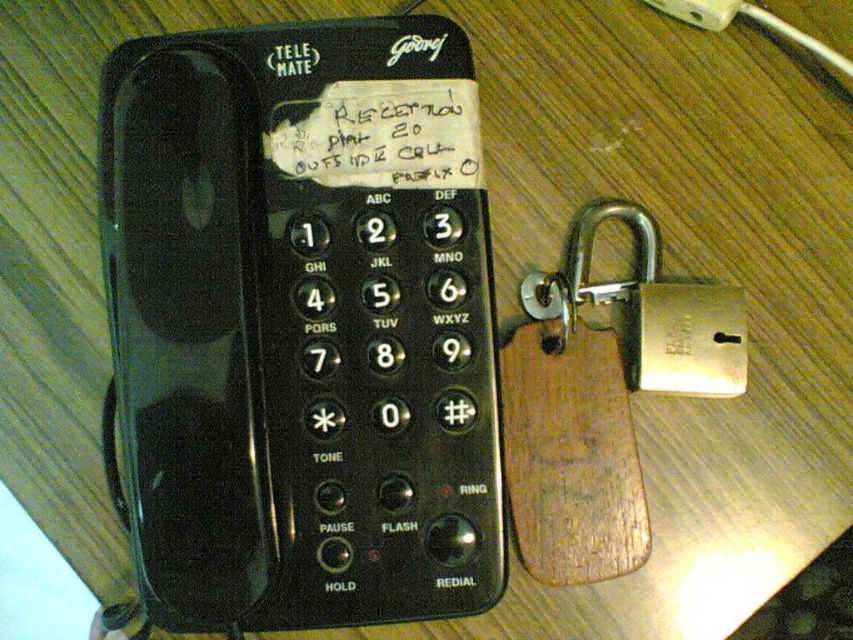
Question: Estimate the real-world distances between objects in this image. Which object is farther from the white plastic plug at upper right?

Choices:
 (A) black plastic telephone at center
 (B) white paper at center

Answer: (A)

Question: Does black plastic telephone at center appear on the right side of white plastic plug at upper right?

Choices:
 (A) yes
 (B) no

Answer: (B)

Question: Which point is farther to the camera?

Choices:
 (A) black plastic telephone at center
 (B) white paper at center

Answer: (B)

Question: Can you confirm if white paper at center is bigger than white plastic plug at upper right?

Choices:
 (A) no
 (B) yes

Answer: (B)

Question: Does black plastic telephone at center have a smaller size compared to white paper at center?

Choices:
 (A) no
 (B) yes

Answer: (A)

Question: Estimate the real-world distances between objects in this image. Which object is farther from the black plastic telephone at center?

Choices:
 (A) white paper at center
 (B) white plastic plug at upper right

Answer: (B)